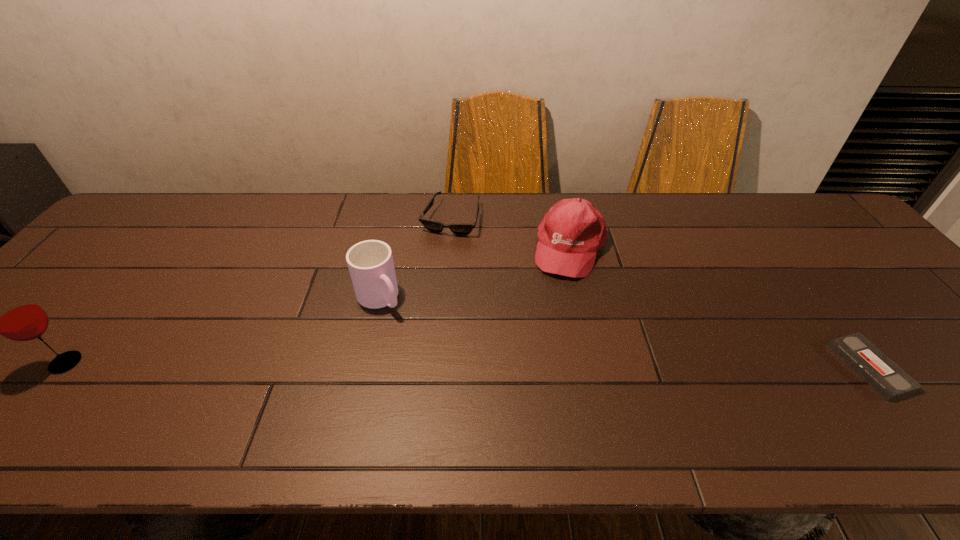
Locate an element on the screen. This screenshot has height=540, width=960. the leftmost object is located at coordinates (13, 315).

Where is `the tallest object`? the tallest object is located at coordinates (13, 315).

This screenshot has width=960, height=540. I want to click on the shortest object, so click(878, 370).

The width and height of the screenshot is (960, 540). In order to click on the rightmost object in this screenshot , I will do `click(878, 370)`.

Image resolution: width=960 pixels, height=540 pixels. I want to click on the second object from left to right, so click(370, 262).

Locate an element on the screen. The width and height of the screenshot is (960, 540). baseball cap is located at coordinates (571, 233).

The image size is (960, 540). I want to click on the second shortest object, so click(457, 228).

The height and width of the screenshot is (540, 960). Identify the location of sunglasses. (457, 228).

The image size is (960, 540). I want to click on vacant space located 0.100m on the left of the glass, so click(4, 363).

Image resolution: width=960 pixels, height=540 pixels. Find the location of `free space located on the left of the rightmost object`. free space located on the left of the rightmost object is located at coordinates (770, 367).